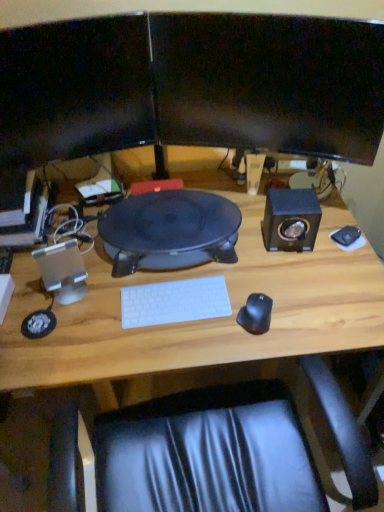
Where is `vacant area that is in front of matte black speaker at center`? vacant area that is in front of matte black speaker at center is located at coordinates (160, 323).